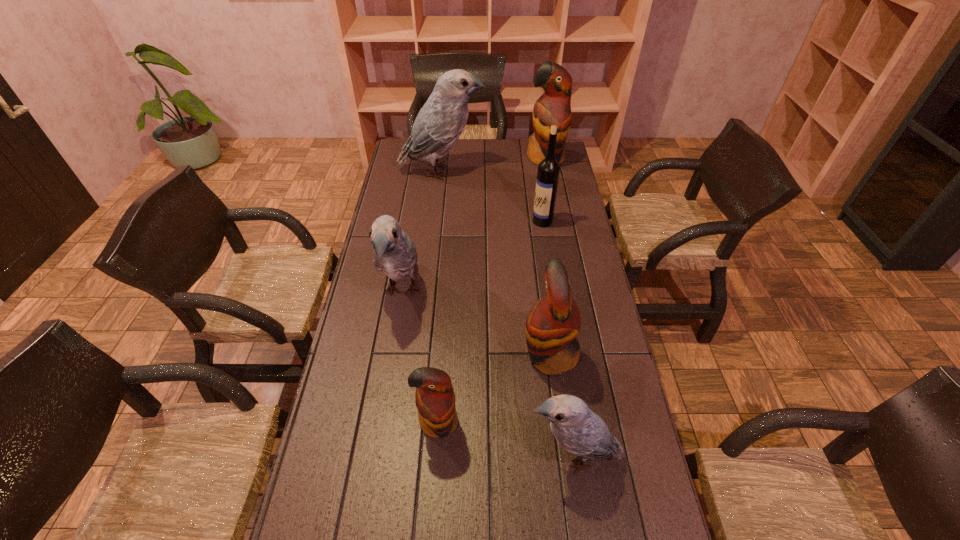
Where is `vacant space at the right edge of the desktop`? Image resolution: width=960 pixels, height=540 pixels. vacant space at the right edge of the desktop is located at coordinates (587, 327).

Identify the location of vacant region between the wine bottle and the farthest gray parrot. (492, 197).

Find the location of `vacant point located between the second nearest gray parrot and the third nearest parrot`. vacant point located between the second nearest gray parrot and the third nearest parrot is located at coordinates [476, 323].

At what (x,y) coordinates should I click in order to perform the action: click on vacant point located between the biggest red parrot and the farthest gray parrot. Please return your answer as a coordinate pair (x, y). The width and height of the screenshot is (960, 540). Looking at the image, I should click on (493, 165).

Where is `free spot between the fourth nearest parrot and the smallest red parrot`? The width and height of the screenshot is (960, 540). free spot between the fourth nearest parrot and the smallest red parrot is located at coordinates (420, 357).

Where is `free point between the farthest gray parrot and the rightmost gray parrot`? free point between the farthest gray parrot and the rightmost gray parrot is located at coordinates (508, 314).

You are a GUI agent. You are given a task and a screenshot of the screen. Output one action in this format:
    pyautogui.click(x=<x>, y=<y>)
    Task: Click on the vacant region between the biggest gray parrot and the fourth farthest object
    
    Given the screenshot: What is the action you would take?
    pyautogui.click(x=421, y=232)

Image resolution: width=960 pixels, height=540 pixels. Identify the location of free space between the farthest red parrot and the second farthest gray parrot. (474, 225).

At what (x,y) coordinates should I click in order to perform the action: click on object that is the fourth closest to the biggest red parrot. Please return your answer as a coordinate pair (x, y). The height and width of the screenshot is (540, 960). Looking at the image, I should click on (553, 323).

The image size is (960, 540). I want to click on object that is the third closest to the nearest red parrot, so click(x=395, y=255).